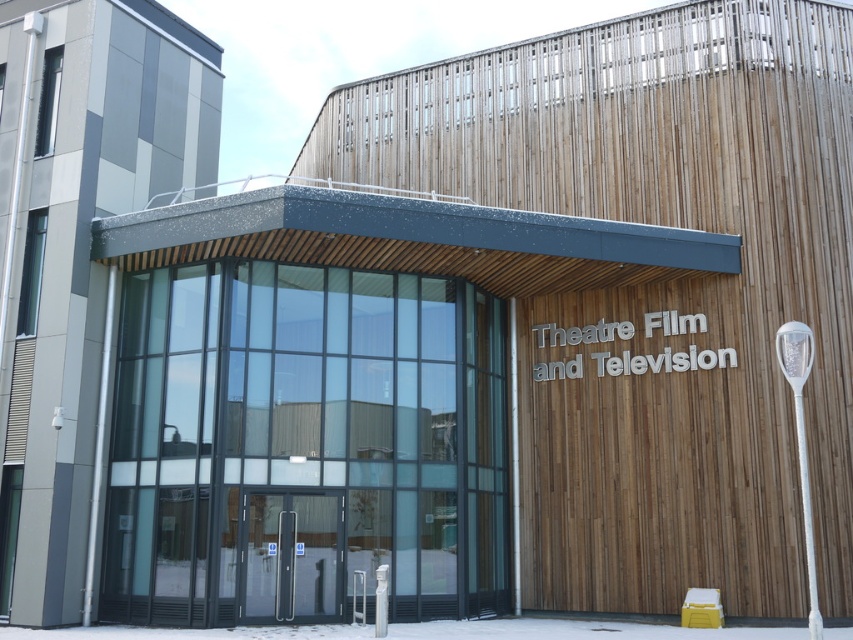
You are standing outside the modern building and want to enter through the transparent glass doors at center. However, there is white powdery snow at lower center blocking your path. Can you step over the snow to reach the doors?

The transparent glass doors at center are much taller than the white powdery snow at lower center, so you can easily step over the snow to reach the doors.

You are a delivery person trying to enter the building through the transparent glass doors at center. The path to the doors is covered by the white powdery snow at lower center. Can you walk straight to the doors without stepping on the snow?

The transparent glass doors at center has a lesser width compared to white powdery snow at lower center, so the snow covers a wider area than the doors. Therefore, you would have to step on the snow to reach the doors.

You are standing in front of the modern theatre building and want to take a photo. You notice two points marked on the building facade at coordinates point (x=300, y=525) and point (x=831, y=632). Which point is closer to your camera lens when taking the picture?

Point (x=300, y=525) is further to the camera than point (x=831, y=632), so the point closer to the camera lens is point (x=831, y=632).